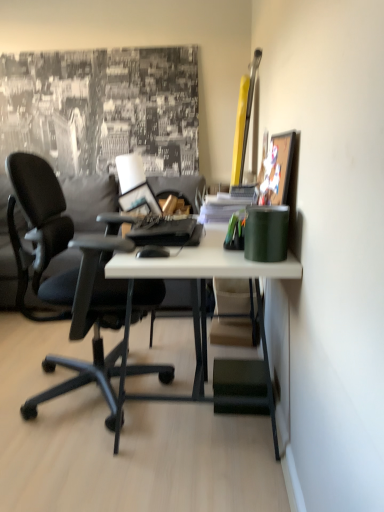
Locate an element on the screen. The image size is (384, 512). vacant space underneath white matte desk at center (from a real-world perspective) is located at coordinates (188, 398).